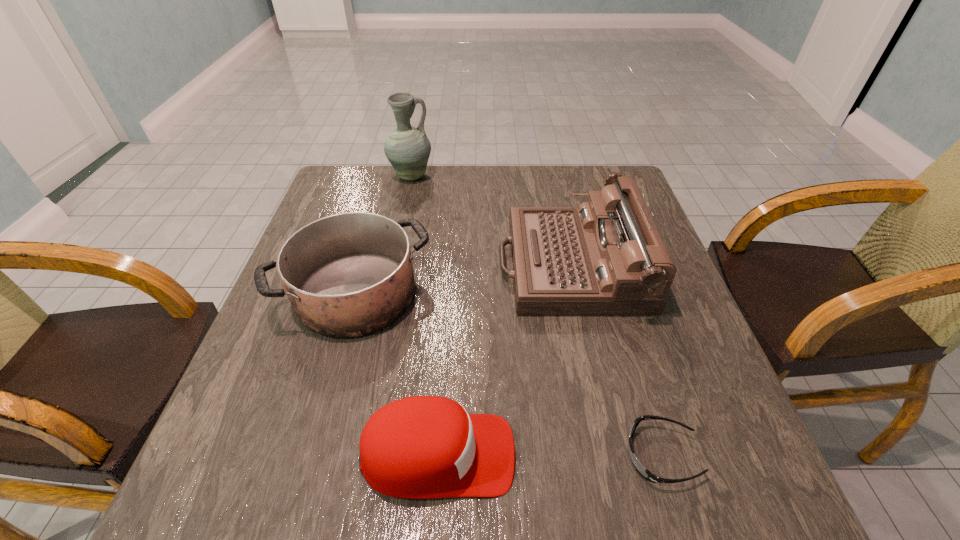
What are the coordinates of `sunglasses that is at the right edge` in the screenshot? It's located at (645, 473).

At what (x,y) coordinates should I click in order to perform the action: click on object that is positioned at the near right corner. Please return your answer as a coordinate pair (x, y). The height and width of the screenshot is (540, 960). Looking at the image, I should click on (645, 473).

I want to click on vacant space at the far edge of the desktop, so click(x=465, y=164).

This screenshot has width=960, height=540. What are the coordinates of `vacant area at the near edge` in the screenshot? It's located at (506, 495).

The image size is (960, 540). I want to click on vacant space at the left edge of the desktop, so click(x=265, y=459).

This screenshot has height=540, width=960. In order to click on vacant space at the right edge in this screenshot , I will do `click(637, 341)`.

In the image, there is a desktop. Identify the location of vacant space at the far left corner. (369, 185).

Locate an element on the screen. free space at the near right corner is located at coordinates point(677,515).

Identify the location of vacant space that is in between the third shortest object and the second shortest object. (397, 374).

In order to click on vacant area that lies between the shortest object and the baseball cap in this screenshot , I will do `click(549, 455)`.